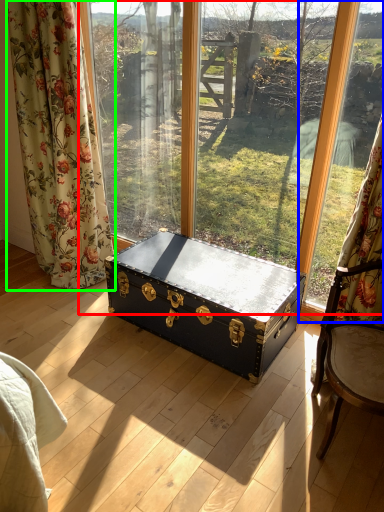
Question: Which object is positioned farthest from window (highlighted by a red box)? Select from window frame (highlighted by a blue box) and curtain (highlighted by a green box).

Choices:
 (A) window frame
 (B) curtain

Answer: (B)